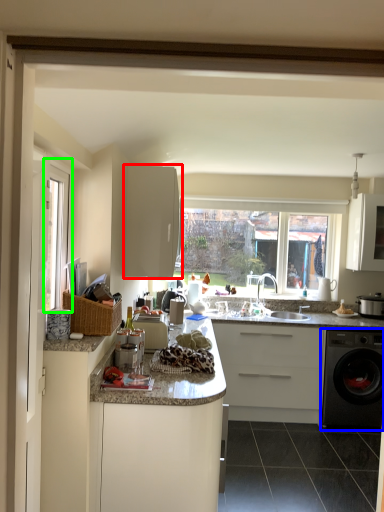
Question: Based on their relative distances, which object is nearer to cabinetry (highlighted by a red box)? Choose from washing machine (highlighted by a blue box) and window frame (highlighted by a green box).

Choices:
 (A) washing machine
 (B) window frame

Answer: (B)